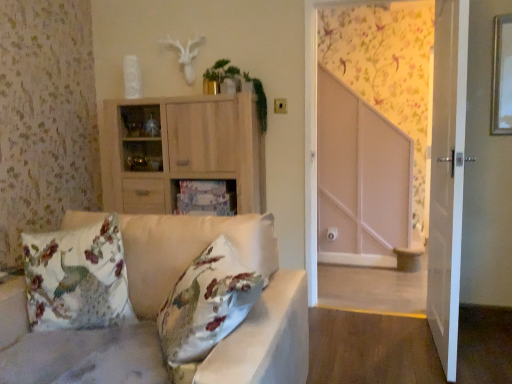
Question: Considering the positions of wooden cabinet at center, positioned as the 2th cabinetry in top-to-bottom order, and white glossy door at right in the image, is wooden cabinet at center, positioned as the 2th cabinetry in top-to-bottom order, taller or shorter than white glossy door at right?

Choices:
 (A) short
 (B) tall

Answer: (A)

Question: Would you say wooden cabinet at center, the first cabinetry positioned from the bottom, is inside or outside white glossy door at right?

Choices:
 (A) outside
 (B) inside

Answer: (A)

Question: Based on their relative distances, which object is nearer to the satin white studio couch at left?

Choices:
 (A) light wood cabinet at center, placed as the 2th cabinetry when sorted from bottom to top
 (B) wooden cabinet at center, positioned as the 2th cabinetry in top-to-bottom order
 (C) floral wallpaper at upper right
 (D) floral fabric cushion at left
 (E) white glossy door at right

Answer: (D)

Question: Which object is the farthest from the floral fabric cushion at left?

Choices:
 (A) light wood cabinet at center, the first cabinetry from the top
 (B) wooden cabinet at center, positioned as the 2th cabinetry in top-to-bottom order
 (C) white glossy door at right
 (D) satin white studio couch at left
 (E) floral wallpaper at upper right

Answer: (E)